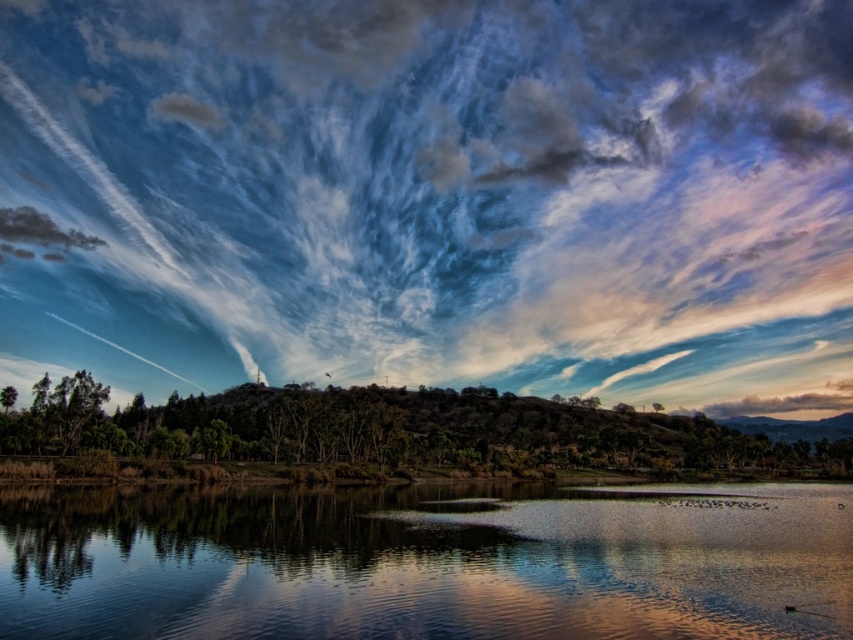
Question: Does smooth reflective water at center have a lesser width compared to green matte tree at center?

Choices:
 (A) no
 (B) yes

Answer: (B)

Question: Does cloudy sky at center appear under smooth reflective water at center?

Choices:
 (A) yes
 (B) no

Answer: (B)

Question: Does smooth reflective water at center have a larger size compared to green matte tree at center?

Choices:
 (A) yes
 (B) no

Answer: (B)

Question: Which object is the closest to the green matte tree at center?

Choices:
 (A) smooth reflective water at center
 (B) cloudy sky at center

Answer: (A)

Question: Which object is farther from the camera taking this photo?

Choices:
 (A) green matte tree at center
 (B) cloudy sky at center
 (C) smooth reflective water at center

Answer: (B)

Question: Which is nearer to the cloudy sky at center?

Choices:
 (A) smooth reflective water at center
 (B) green matte tree at center

Answer: (B)